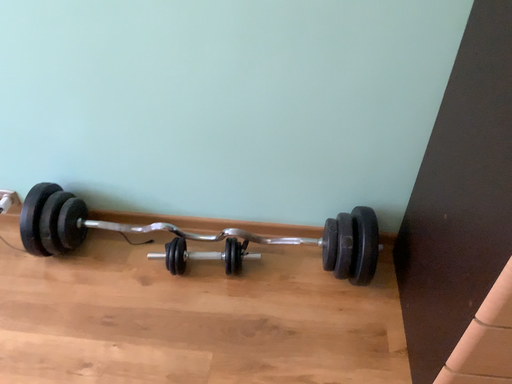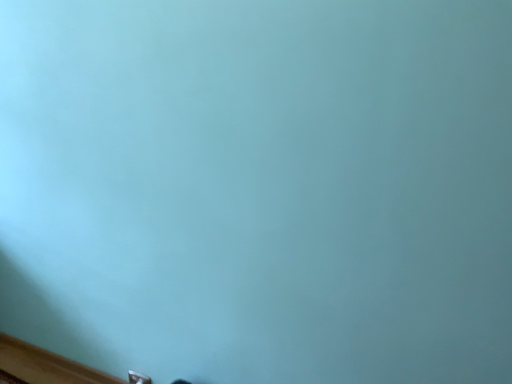
Question: How did the camera likely rotate when shooting the video?

Choices:
 (A) rotated downward
 (B) rotated upward

Answer: (B)